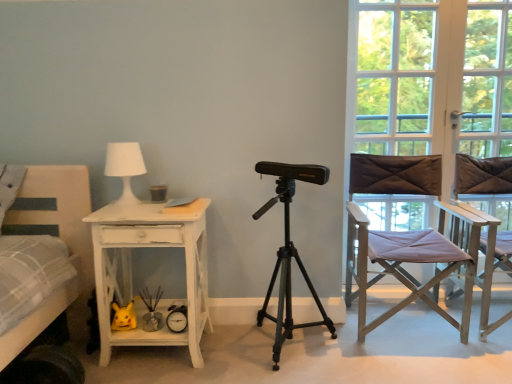
Locate an element on the screen. The height and width of the screenshot is (384, 512). empty space that is to the right of metallic tripod at center is located at coordinates (374, 363).